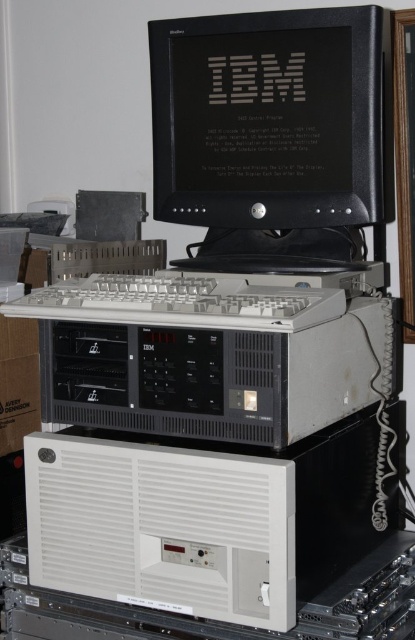
You are setting up a desk and have limited space. You need to place the black glossy monitor at center and the gray matte keyboard at center side by side. Based on their sizes, which one should be placed on the left to ensure they both fit within the desk space?

The black glossy monitor at center has a smaller width than the gray matte keyboard at center, so placing the monitor on the left and the keyboard on the right would allow both to fit within the desk space.

You are setting up a desk for an 80s retro computing setup. You have a black glossy monitor at center and a white plastic keyboard at center. The desk is 1 meter wide. Can both items fit side by side on the desk without overlapping?

The black glossy monitor at center and white plastic keyboard at center are 22.17 centimeters apart from each other. Since the desk is 1 meter wide, which is 100 centimeters, there is sufficient space to place both items side by side without overlapping.